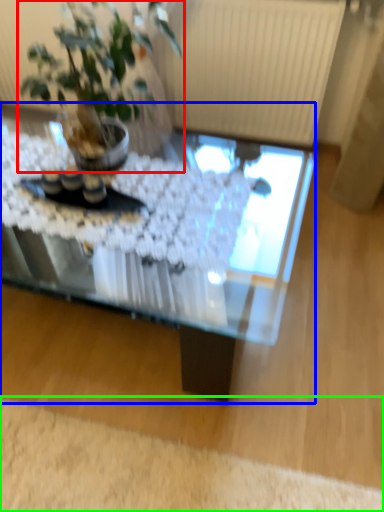
Question: Based on their relative distances, which object is farther from houseplant (highlighted by a red box)? Choose from coffee table (highlighted by a blue box) and plain (highlighted by a green box).

Choices:
 (A) coffee table
 (B) plain

Answer: (B)